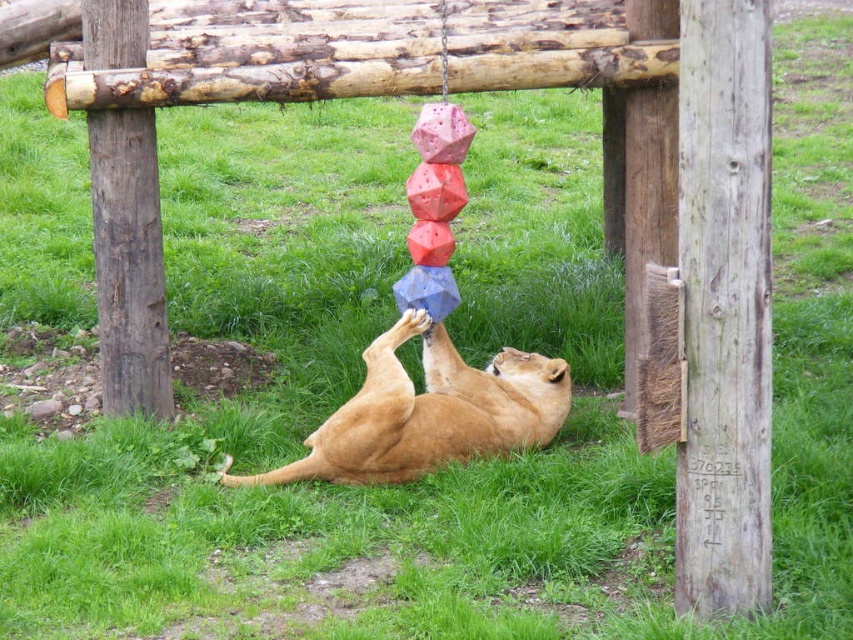
Question: Among these points, which one is farthest from the camera?

Choices:
 (A) (692, 512)
 (B) (508, 440)

Answer: (B)

Question: Which object appears closest to the camera in this image?

Choices:
 (A) brown rough wood pole at left
 (B) weathered wood pole at right
 (C) golden fur lion at center

Answer: (B)

Question: Can you confirm if golden fur lion at center is positioned to the left of brown rough wood pole at left?

Choices:
 (A) no
 (B) yes

Answer: (A)

Question: Does golden fur lion at center have a lesser width compared to brown rough wood pole at left?

Choices:
 (A) no
 (B) yes

Answer: (A)

Question: Does golden fur lion at center appear over brown rough wood pole at left?

Choices:
 (A) no
 (B) yes

Answer: (A)

Question: Considering the real-world distances, which object is farthest from the weathered wood pole at right?

Choices:
 (A) brown rough wood pole at left
 (B) golden fur lion at center

Answer: (A)